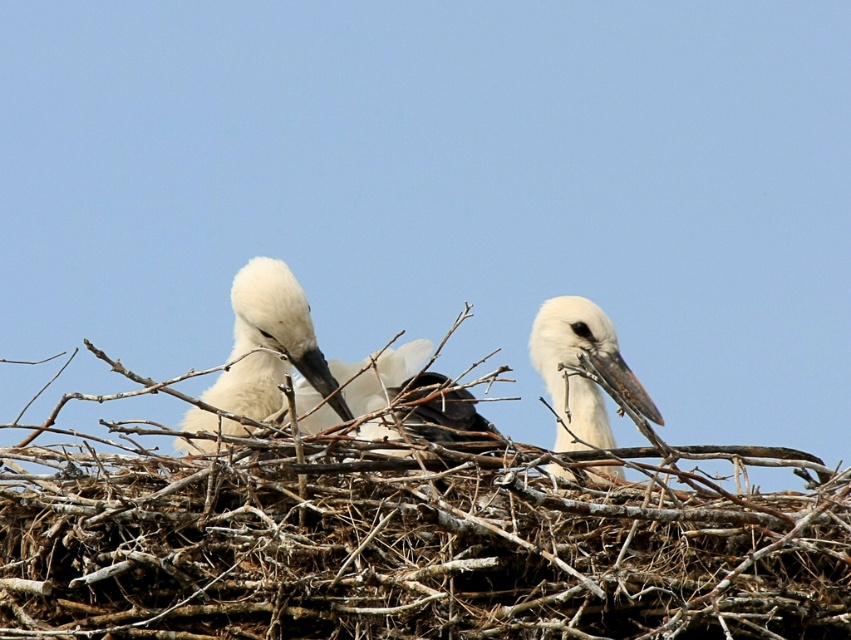
You are a birdwatcher trying to identify two birds in a nest. You see a white matte bird at center and a white matte stork at right. Which one is wider?

The white matte bird at center is wider than the white matte stork at right.

You are a birdwatcher trying to observe two white matte birds in a nest. You have a camera with a minimum focus distance of 20 inches. Can you take a clear photo of both the white matte bird at center and the white matte stork at right simultaneously?

The distance between the white matte bird at center and white matte stork at right is 20.88 inches. Since your camera can focus as close as 20 inches, you can capture both birds in the same frame as they are within the required distance.